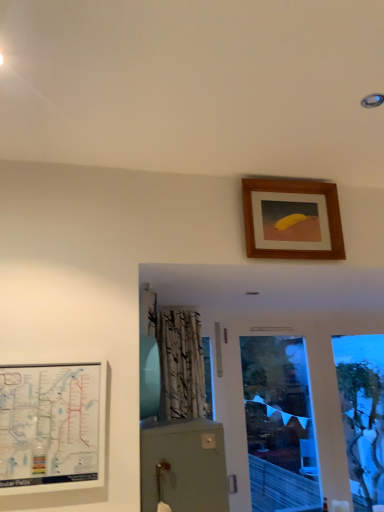
You are a GUI agent. You are given a task and a screenshot of the screen. Output one action in this format:
    pyautogui.click(x=<x>, y=<y>)
    Task: Click on the wooden picture frame at upper center, which is the 1th picture frame in back-to-front order
    Image resolution: width=384 pixels, height=512 pixels.
    Given the screenshot: What is the action you would take?
    coord(294,195)

What do you see at coordinates (294, 195) in the screenshot?
I see `wooden picture frame at upper center, marked as the second picture frame in a front-to-back arrangement` at bounding box center [294, 195].

At what (x,y) coordinates should I click in order to perform the action: click on white matte subway map at lower left, the 2th picture frame positioned from the right. Please return your answer as a coordinate pair (x, y). The image size is (384, 512). Looking at the image, I should click on (51, 426).

How much space does white matte subway map at lower left, placed as the 1th picture frame when sorted from front to back, occupy vertically?

white matte subway map at lower left, placed as the 1th picture frame when sorted from front to back, is 18.27 inches in height.

What do you see at coordinates (51, 426) in the screenshot? I see `white matte subway map at lower left, which appears as the 1th picture frame when viewed from the left` at bounding box center [51, 426].

In order to click on wooden picture frame at upper center, marked as the second picture frame in a front-to-back arrangement in this screenshot , I will do `click(294, 195)`.

Based on their positions, is white matte subway map at lower left, which is the second picture frame in back-to-front order, located to the left or right of wooden picture frame at upper center, marked as the second picture frame in a front-to-back arrangement?

white matte subway map at lower left, which is the second picture frame in back-to-front order, is to the left of wooden picture frame at upper center, marked as the second picture frame in a front-to-back arrangement.

In the image, is white matte subway map at lower left, which appears as the 1th picture frame when viewed from the left, positioned in front of or behind wooden picture frame at upper center, the 1th picture frame when ordered from right to left?

In the image, white matte subway map at lower left, which appears as the 1th picture frame when viewed from the left, appears in front of wooden picture frame at upper center, the 1th picture frame when ordered from right to left.

Is point (64, 385) closer or farther from the camera than point (277, 248)?

Clearly, point (64, 385) is closer to the camera than point (277, 248).

From the image's perspective, would you say white matte subway map at lower left, the 1th picture frame ordered from the bottom, is positioned over wooden picture frame at upper center, placed as the 2th picture frame when sorted from left to right?

No, from the image's perspective, white matte subway map at lower left, the 1th picture frame ordered from the bottom, is not on top of wooden picture frame at upper center, placed as the 2th picture frame when sorted from left to right.

Consider the image. From a real-world perspective, which is physically below, white matte subway map at lower left, placed as the 1th picture frame when sorted from front to back, or wooden picture frame at upper center, which is the 1th picture frame in back-to-front order?

white matte subway map at lower left, placed as the 1th picture frame when sorted from front to back, is physically lower.

In terms of width, does white matte subway map at lower left, arranged as the second picture frame when viewed from the top, look wider or thinner when compared to wooden picture frame at upper center, which is the 1th picture frame in back-to-front order?

white matte subway map at lower left, arranged as the second picture frame when viewed from the top, is thinner than wooden picture frame at upper center, which is the 1th picture frame in back-to-front order.

Considering the relative sizes of white matte subway map at lower left, the 2th picture frame positioned from the right, and wooden picture frame at upper center, the 2th picture frame in the bottom-to-top sequence, in the image provided, is white matte subway map at lower left, the 2th picture frame positioned from the right, taller than wooden picture frame at upper center, the 2th picture frame in the bottom-to-top sequence,?

Yes.

Considering the relative sizes of white matte subway map at lower left, arranged as the second picture frame when viewed from the top, and wooden picture frame at upper center, placed as the 2th picture frame when sorted from left to right, in the image provided, is white matte subway map at lower left, arranged as the second picture frame when viewed from the top, smaller than wooden picture frame at upper center, placed as the 2th picture frame when sorted from left to right,?

Correct, white matte subway map at lower left, arranged as the second picture frame when viewed from the top, occupies less space than wooden picture frame at upper center, placed as the 2th picture frame when sorted from left to right.

Can we say white matte subway map at lower left, which is the second picture frame in back-to-front order, lies outside wooden picture frame at upper center, the 1th picture frame when ordered from right to left?

That's correct, white matte subway map at lower left, which is the second picture frame in back-to-front order, is outside of wooden picture frame at upper center, the 1th picture frame when ordered from right to left.

Is white matte subway map at lower left, which is the second picture frame in back-to-front order, next to wooden picture frame at upper center, marked as the second picture frame in a front-to-back arrangement, and touching it?

white matte subway map at lower left, which is the second picture frame in back-to-front order, is not next to wooden picture frame at upper center, marked as the second picture frame in a front-to-back arrangement, and they're not touching.

Is white matte subway map at lower left, which is the second picture frame in back-to-front order, oriented away from wooden picture frame at upper center, the 2th picture frame in the bottom-to-top sequence?

white matte subway map at lower left, which is the second picture frame in back-to-front order, is not turned away from wooden picture frame at upper center, the 2th picture frame in the bottom-to-top sequence.

What's the angular difference between white matte subway map at lower left, which appears as the 1th picture frame when viewed from the left, and wooden picture frame at upper center, acting as the first picture frame starting from the top,'s facing directions?

The angle between the facing direction of white matte subway map at lower left, which appears as the 1th picture frame when viewed from the left, and the facing direction of wooden picture frame at upper center, acting as the first picture frame starting from the top, is 0.0065 degrees.

Where is `picture frame on the left of wooden picture frame at upper center, the 1th picture frame when ordered from right to left`? The image size is (384, 512). picture frame on the left of wooden picture frame at upper center, the 1th picture frame when ordered from right to left is located at coordinates (51, 426).

Is wooden picture frame at upper center, acting as the first picture frame starting from the top, to the right of white matte subway map at lower left, which is the second picture frame in back-to-front order, from the viewer's perspective?

Yes.

Which object is further away from the camera, wooden picture frame at upper center, the 2th picture frame in the bottom-to-top sequence, or white matte subway map at lower left, which is the second picture frame in back-to-front order?

wooden picture frame at upper center, the 2th picture frame in the bottom-to-top sequence, is more distant.

Considering the positions of points (304, 221) and (36, 458), is point (304, 221) closer to camera compared to point (36, 458)?

No, it is behind (36, 458).

From the image's perspective, is wooden picture frame at upper center, which is the 1th picture frame in back-to-front order, beneath white matte subway map at lower left, which is the second picture frame in back-to-front order?

Incorrect, from the image's perspective, wooden picture frame at upper center, which is the 1th picture frame in back-to-front order, is higher than white matte subway map at lower left, which is the second picture frame in back-to-front order.

From a real-world perspective, is wooden picture frame at upper center, placed as the 2th picture frame when sorted from left to right, physically below white matte subway map at lower left, which appears as the 1th picture frame when viewed from the left?

Incorrect, from a real-world perspective, wooden picture frame at upper center, placed as the 2th picture frame when sorted from left to right, is higher than white matte subway map at lower left, which appears as the 1th picture frame when viewed from the left.

Considering the relative sizes of wooden picture frame at upper center, the 1th picture frame when ordered from right to left, and white matte subway map at lower left, arranged as the second picture frame when viewed from the top, in the image provided, is wooden picture frame at upper center, the 1th picture frame when ordered from right to left, wider than white matte subway map at lower left, arranged as the second picture frame when viewed from the top,?

Yes.

In terms of height, does wooden picture frame at upper center, which is the 1th picture frame in back-to-front order, look taller or shorter compared to white matte subway map at lower left, which appears as the 1th picture frame when viewed from the left?

wooden picture frame at upper center, which is the 1th picture frame in back-to-front order, is shorter than white matte subway map at lower left, which appears as the 1th picture frame when viewed from the left.

Is wooden picture frame at upper center, placed as the 2th picture frame when sorted from left to right, bigger or smaller than white matte subway map at lower left, placed as the 1th picture frame when sorted from front to back?

Considering their sizes, wooden picture frame at upper center, placed as the 2th picture frame when sorted from left to right, takes up more space than white matte subway map at lower left, placed as the 1th picture frame when sorted from front to back.

Is wooden picture frame at upper center, marked as the second picture frame in a front-to-back arrangement, not within white matte subway map at lower left, the 1th picture frame ordered from the bottom?

Yes, wooden picture frame at upper center, marked as the second picture frame in a front-to-back arrangement, is not within white matte subway map at lower left, the 1th picture frame ordered from the bottom.

Is wooden picture frame at upper center, marked as the second picture frame in a front-to-back arrangement, with white matte subway map at lower left, placed as the 1th picture frame when sorted from front to back?

No, wooden picture frame at upper center, marked as the second picture frame in a front-to-back arrangement, is not beside white matte subway map at lower left, placed as the 1th picture frame when sorted from front to back.

Is wooden picture frame at upper center, placed as the 2th picture frame when sorted from left to right, facing towards white matte subway map at lower left, placed as the 1th picture frame when sorted from front to back?

No, wooden picture frame at upper center, placed as the 2th picture frame when sorted from left to right, does not turn towards white matte subway map at lower left, placed as the 1th picture frame when sorted from front to back.

How different are the orientations of wooden picture frame at upper center, the 1th picture frame when ordered from right to left, and white matte subway map at lower left, which appears as the 1th picture frame when viewed from the left, in degrees?

0.0065 degrees.

Measure the distance from wooden picture frame at upper center, acting as the first picture frame starting from the top, to white matte subway map at lower left, which appears as the 1th picture frame when viewed from the left.

wooden picture frame at upper center, acting as the first picture frame starting from the top, is 1.07 meters away from white matte subway map at lower left, which appears as the 1th picture frame when viewed from the left.

You are a GUI agent. You are given a task and a screenshot of the screen. Output one action in this format:
    pyautogui.click(x=<x>, y=<y>)
    Task: Click on the picture frame that appears above the white matte subway map at lower left, the 1th picture frame ordered from the bottom (from a real-world perspective)
    This screenshot has height=512, width=384.
    Given the screenshot: What is the action you would take?
    pyautogui.click(x=294, y=195)

Where is `picture frame that appears above the white matte subway map at lower left, which appears as the 1th picture frame when viewed from the left (from a real-world perspective)`? The width and height of the screenshot is (384, 512). picture frame that appears above the white matte subway map at lower left, which appears as the 1th picture frame when viewed from the left (from a real-world perspective) is located at coordinates (294, 195).

I want to click on picture frame below the wooden picture frame at upper center, marked as the second picture frame in a front-to-back arrangement (from a real-world perspective), so (x=51, y=426).